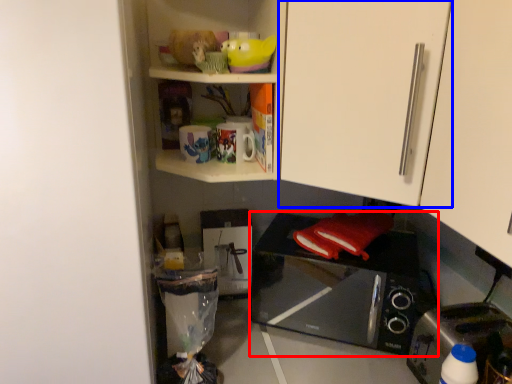
Question: Which point is further to the camera, microwave oven (highlighted by a red box) or cabinetry (highlighted by a blue box)?

Choices:
 (A) microwave oven
 (B) cabinetry

Answer: (A)